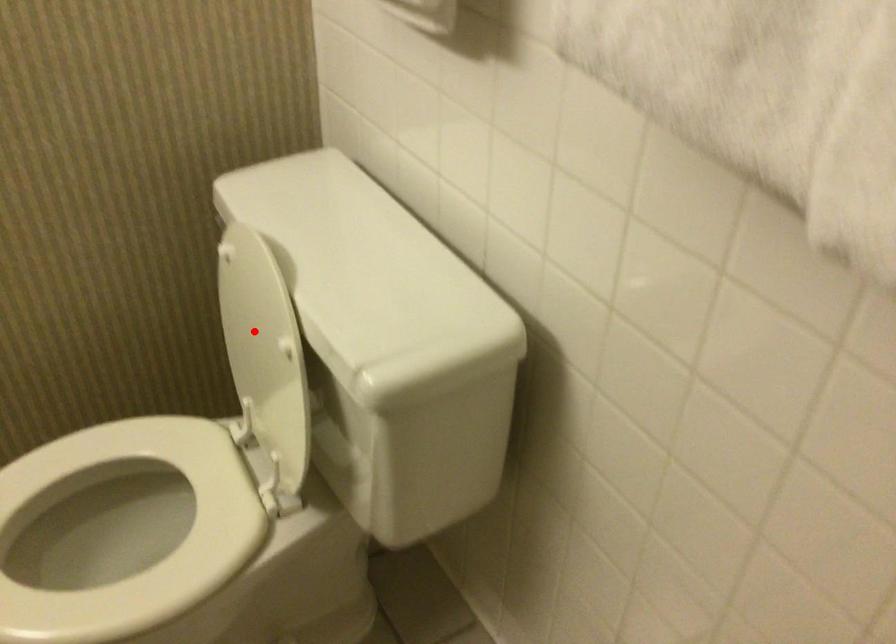
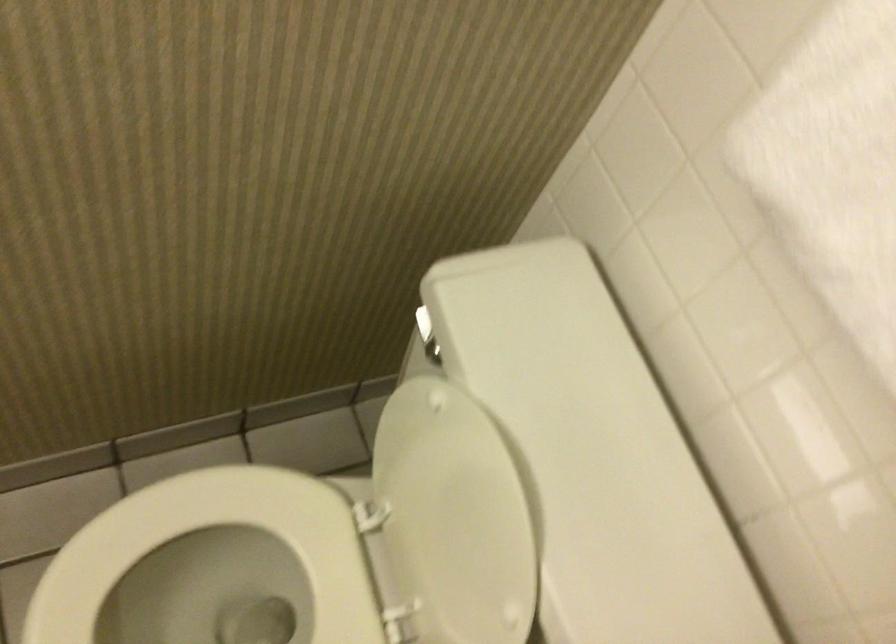
Question: A red point is marked in image1. In image2, is the corresponding 3D point closer to the camera or farther? Reply with the corresponding letter.

Choices:
 (A) The corresponding 3D point is closer.
 (B) The corresponding 3D point is farther.

Answer: (A)